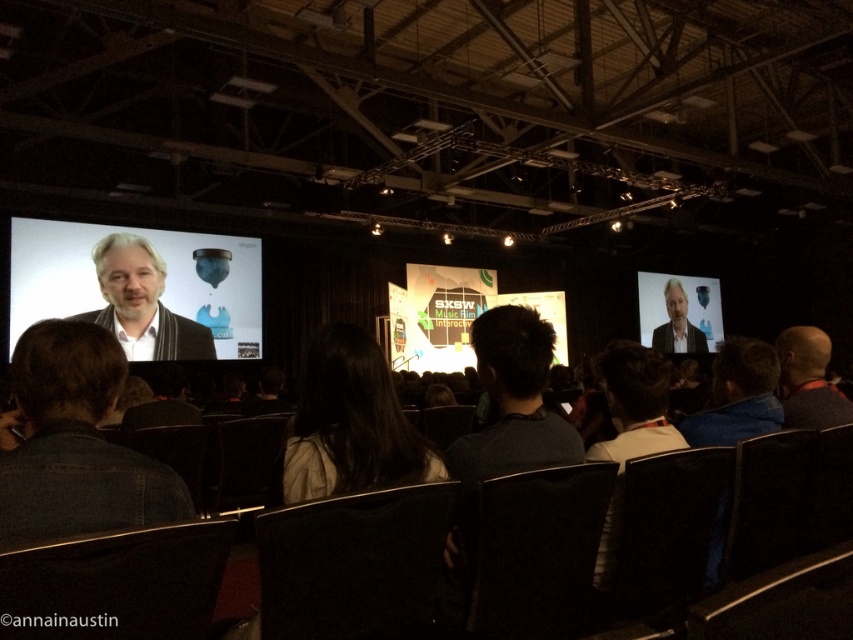
Based on the photo, you are an event photographer who needs to capture a photo of both the dark blue shirt at lower right and the bald head at right in the same frame. Based on their positions, which one should you focus on first to ensure both are in the shot?

The dark blue shirt at lower right is positioned on the left side of bald head at right, so you should focus on the bald head at right first to ensure both are included in the frame.

You are an event photographer positioned at the back of the hall. You need to capture a clear photo of the speaker. The dark hair at center and dark gray shirt at center are both in your frame. Which object should you focus on to ensure the speaker is in focus?

The dark hair at center is not as tall as the dark gray shirt at center, so you should focus on the dark gray shirt at center to ensure the speaker is in focus.